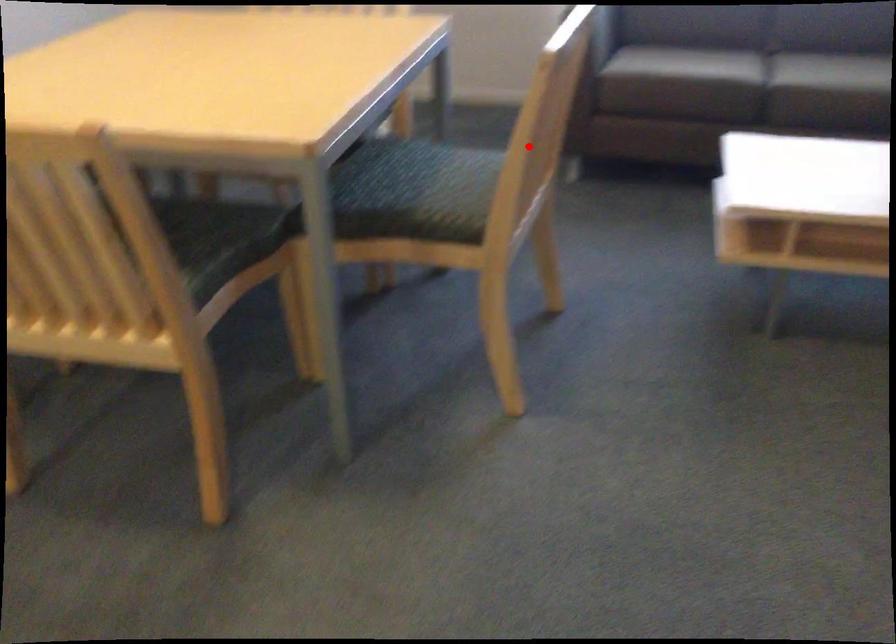
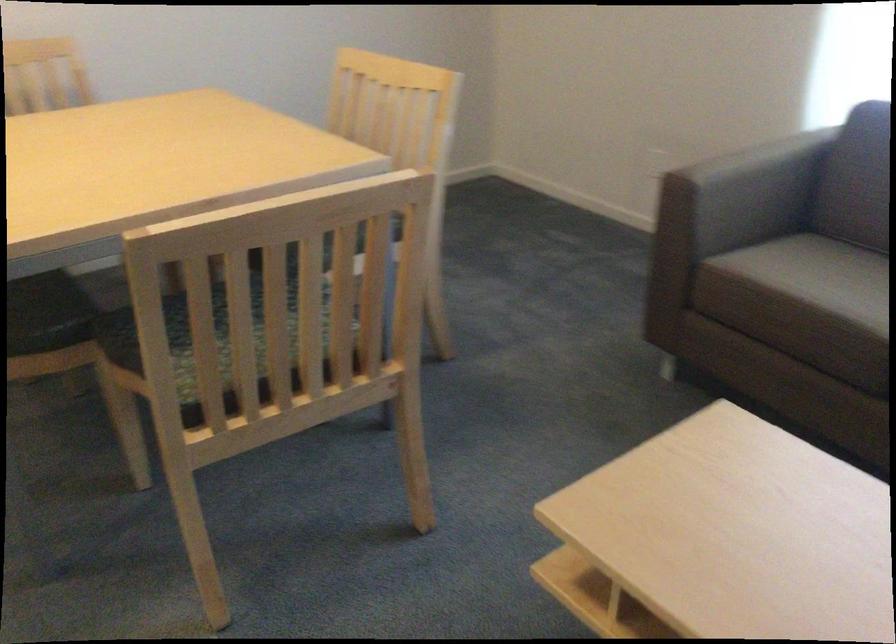
Question: I am providing you with two images of the same scene from different viewpoints. In image1, a red point is highlighted. Considering the same 3D point in image2, which of the following is correct?

Choices:
 (A) It is closer
 (B) It is farther

Answer: (A)